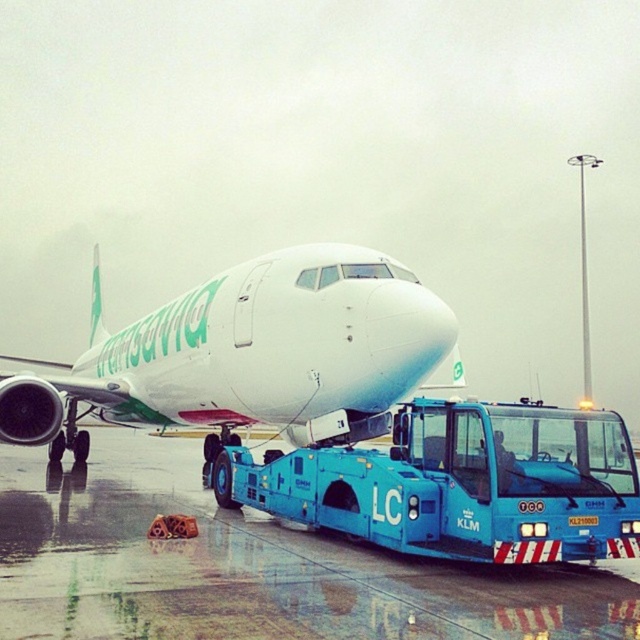
You are a ground crew member who needs to drive the blue metallic tow truck at center across the wet asphalt runway at lower center. Can the tow truck safely cross the runway without getting stuck? Explain your reasoning based on the runway and truck dimensions.

The wet asphalt runway at lower center is wider than the blue metallic tow truck at center. Since the runway is wider, the tow truck can safely cross without getting stuck as there is sufficient space for maneuvering.

You are a ground crew member who needs to ensure the white glossy airplane at upper center can safely taxi along the wet asphalt runway at lower center. Based on their widths, will the airplane fit on the runway?

The wet asphalt runway at lower center has a lesser width compared to white glossy airplane at upper center, so the airplane will not fit safely on the runway.

You are a ground crew member at the airport. You need to move the blue metallic tow truck at center to another location. Before moving it, you must ensure there is enough space between the white glossy airplane at upper center and the tow truck. Based on the scene, can you determine if there is sufficient space to safely move the tow truck out from under the airplane?

The white glossy airplane at upper center is above the blue metallic tow truck at center, so there is not enough vertical space to safely move the tow truck out from under the airplane without risking collision.